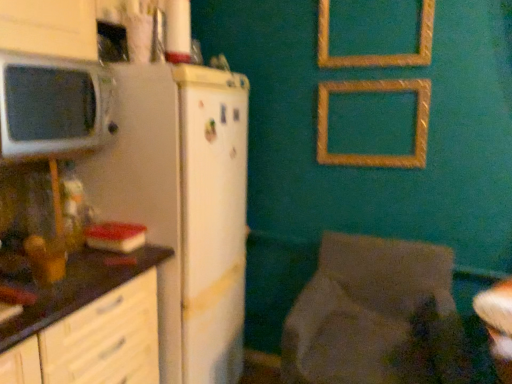
Question: Is textured fabric chair at lower right not near white matte refrigerator at left?

Choices:
 (A) no
 (B) yes

Answer: (A)

Question: Does textured fabric chair at lower right have a greater height compared to white matte refrigerator at left?

Choices:
 (A) yes
 (B) no

Answer: (B)

Question: Can you confirm if textured fabric chair at lower right is thinner than white matte refrigerator at left?

Choices:
 (A) yes
 (B) no

Answer: (B)

Question: Can you confirm if textured fabric chair at lower right is smaller than white matte refrigerator at left?

Choices:
 (A) no
 (B) yes

Answer: (B)

Question: From a real-world perspective, does textured fabric chair at lower right sit lower than white matte refrigerator at left?

Choices:
 (A) no
 (B) yes

Answer: (B)

Question: Is gold textured picture frame at upper center, which is the 2th picture frame from top to bottom, inside or outside of dark brown laminate countertop at left?

Choices:
 (A) outside
 (B) inside

Answer: (A)

Question: From a real-world perspective, is gold textured picture frame at upper center, which is counted as the 1th picture frame, starting from the bottom, above or below dark brown laminate countertop at left?

Choices:
 (A) below
 (B) above

Answer: (B)

Question: Considering the positions of point (350, 82) and point (111, 263), is point (350, 82) closer or farther from the camera than point (111, 263)?

Choices:
 (A) farther
 (B) closer

Answer: (A)

Question: Looking at their shapes, would you say gold textured picture frame at upper center, which is the 2th picture frame from top to bottom, is wider or thinner than dark brown laminate countertop at left?

Choices:
 (A) thin
 (B) wide

Answer: (A)

Question: Based on their positions, is gold textured picture frame at upper center, which is the 2th picture frame from top to bottom, located to the left or right of gold textured picture frame at upper center, which is counted as the second picture frame, starting from the bottom?

Choices:
 (A) left
 (B) right

Answer: (B)

Question: Considering the positions of gold textured picture frame at upper center, which is counted as the 1th picture frame, starting from the bottom, and gold textured picture frame at upper center, the 1th picture frame positioned from the top, in the image, is gold textured picture frame at upper center, which is counted as the 1th picture frame, starting from the bottom, taller or shorter than gold textured picture frame at upper center, the 1th picture frame positioned from the top,?

Choices:
 (A) short
 (B) tall

Answer: (A)

Question: Based on their sizes in the image, would you say gold textured picture frame at upper center, which is counted as the 1th picture frame, starting from the bottom, is bigger or smaller than gold textured picture frame at upper center, the 1th picture frame positioned from the top?

Choices:
 (A) big
 (B) small

Answer: (A)

Question: Is gold textured picture frame at upper center, which is counted as the 1th picture frame, starting from the bottom, wider or thinner than gold textured picture frame at upper center, the 1th picture frame positioned from the top?

Choices:
 (A) thin
 (B) wide

Answer: (B)

Question: Considering the relative positions of gold textured picture frame at upper center, which is counted as the 1th picture frame, starting from the bottom, and white matte refrigerator at left in the image provided, is gold textured picture frame at upper center, which is counted as the 1th picture frame, starting from the bottom, to the left or to the right of white matte refrigerator at left?

Choices:
 (A) right
 (B) left

Answer: (A)

Question: Is gold textured picture frame at upper center, which is counted as the 1th picture frame, starting from the bottom, taller or shorter than white matte refrigerator at left?

Choices:
 (A) short
 (B) tall

Answer: (A)